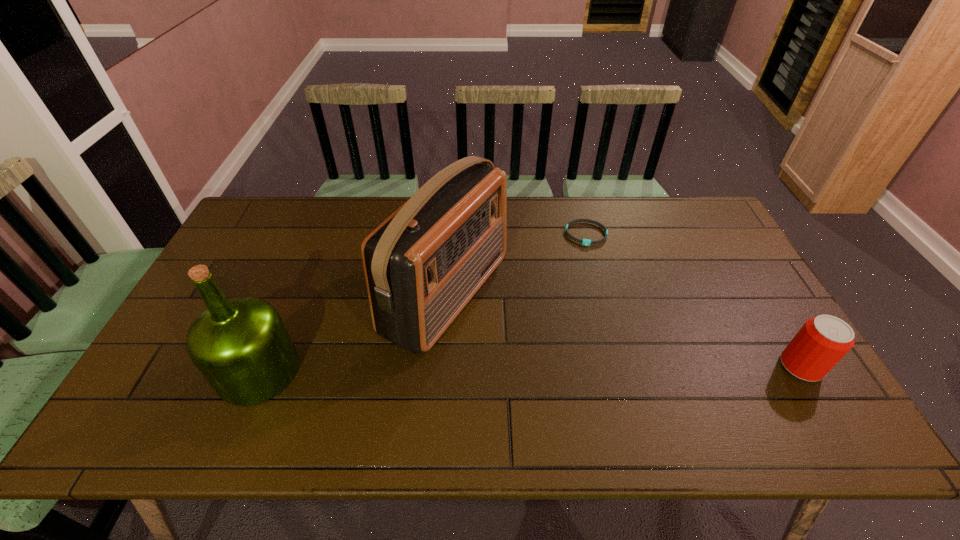
At what (x,y) coordinates should I click in order to perform the action: click on vacant space on the desktop that is between the leftmost object and the third tallest object and is positioned on the front-facing side of the radio receiver. Please return your answer as a coordinate pair (x, y). The height and width of the screenshot is (540, 960). Looking at the image, I should click on (610, 368).

This screenshot has width=960, height=540. In order to click on free space on the desktop that is between the leftmost object and the beer can and is positioned on the buckle of the second object from right to left in this screenshot , I will do `click(612, 368)`.